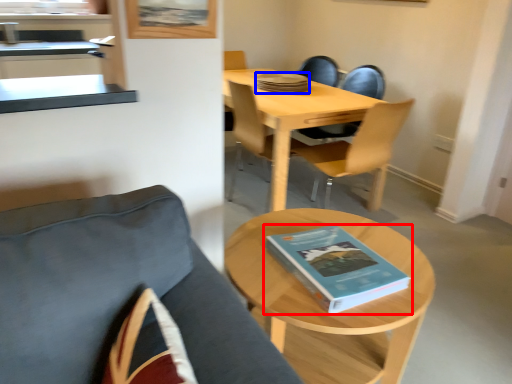
Question: Among these objects, which one is nearest to the camera, book (highlighted by a red box) or book (highlighted by a blue box)?

Choices:
 (A) book
 (B) book

Answer: (A)